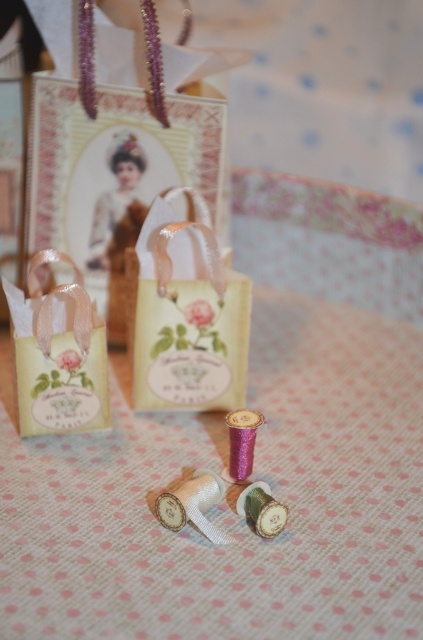
You are organizing a craft fair booth and need to display the pink dotted fabric at center and the matte paper bag at left. Since you want to highlight the taller item, which object should you place on a higher shelf?

The pink dotted fabric at center should be placed on the higher shelf because it has a greater height compared to the matte paper bag at left.

You are an interior designer who wants to place a decorative pillow on the pink dotted fabric at center. According to the coordinates provided, where exactly should you place the pillow?

The pink dotted fabric at center is located at coordinates point [225,504], so you should place the decorative pillow at that exact position to ensure proper placement.

You are organizing a gift wrapping station and need to arrange two matte paper bags. You have a matte paper bag at center and a matte paper bag at left. If you want to place a ribbon between them, where should you put it so it is visible in front of both?

The matte paper bag at left is behind the matte paper bag at center, so place the ribbon in front of the matte paper bag at center to ensure it is visible in front of both.